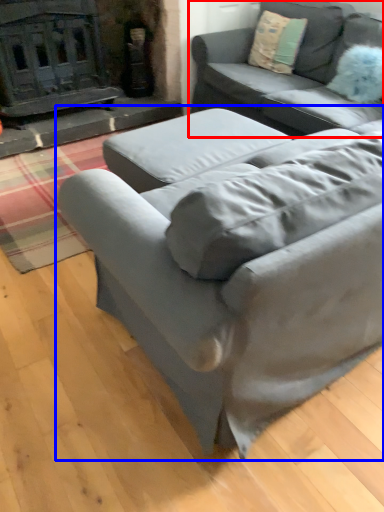
Question: Which of the following is the farthest to the observer, studio couch (highlighted by a red box) or studio couch (highlighted by a blue box)?

Choices:
 (A) studio couch
 (B) studio couch

Answer: (A)